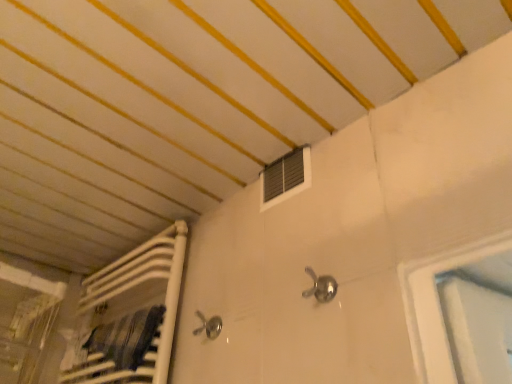
Describe the element at coordinates (321, 287) in the screenshot. This screenshot has width=512, height=384. I see `satin nickel faucet at center` at that location.

In order to face satin nickel faucet at center, should I rotate leftwards or rightwards?

Turn right by 9.237 degrees to look at satin nickel faucet at center.

Image resolution: width=512 pixels, height=384 pixels. Find the location of `satin nickel faucet at center`. satin nickel faucet at center is located at coordinates (321, 287).

Locate an element on the screen. metallic silver air conditioning at upper center is located at coordinates (286, 177).

This screenshot has width=512, height=384. What do you see at coordinates (286, 177) in the screenshot?
I see `metallic silver air conditioning at upper center` at bounding box center [286, 177].

Where is `satin nickel faucet at center`? satin nickel faucet at center is located at coordinates (321, 287).

Is metallic silver air conditioning at upper center at the right side of satin nickel faucet at center?

No.

In the image, is metallic silver air conditioning at upper center positioned in front of or behind satin nickel faucet at center?

Clearly, metallic silver air conditioning at upper center is behind satin nickel faucet at center.

Is point (297, 153) behind point (328, 292)?

Yes, point (297, 153) is behind point (328, 292).

From the image's perspective, is metallic silver air conditioning at upper center located beneath satin nickel faucet at center?

Actually, metallic silver air conditioning at upper center appears above satin nickel faucet at center in the image.

From a real-world perspective, which is physically above, metallic silver air conditioning at upper center or satin nickel faucet at center?

metallic silver air conditioning at upper center, from a real-world perspective.

In terms of width, does metallic silver air conditioning at upper center look wider or thinner when compared to satin nickel faucet at center?

metallic silver air conditioning at upper center is thinner than satin nickel faucet at center.

From their relative heights in the image, would you say metallic silver air conditioning at upper center is taller or shorter than satin nickel faucet at center?

In the image, metallic silver air conditioning at upper center appears to be taller than satin nickel faucet at center.

Does metallic silver air conditioning at upper center have a larger size compared to satin nickel faucet at center?

Yes, metallic silver air conditioning at upper center is bigger than satin nickel faucet at center.

Would you say metallic silver air conditioning at upper center is inside or outside satin nickel faucet at center?

metallic silver air conditioning at upper center is not enclosed by satin nickel faucet at center.

Is metallic silver air conditioning at upper center in contact with satin nickel faucet at center?

No, metallic silver air conditioning at upper center is not in contact with satin nickel faucet at center.

Looking at this image, is satin nickel faucet at center at the back of metallic silver air conditioning at upper center?

No.

Can you tell me how much metallic silver air conditioning at upper center and satin nickel faucet at center differ in facing direction?

There is a 0.0013-degree angle between the facing directions of metallic silver air conditioning at upper center and satin nickel faucet at center.

Locate an element on the screen. The image size is (512, 384). faucet in front of the metallic silver air conditioning at upper center is located at coordinates pos(321,287).

Considering the relative positions of satin nickel faucet at center and metallic silver air conditioning at upper center in the image provided, is satin nickel faucet at center to the left or to the right of metallic silver air conditioning at upper center?

satin nickel faucet at center is positioned on metallic silver air conditioning at upper center's right side.

Who is more distant, satin nickel faucet at center or metallic silver air conditioning at upper center?

metallic silver air conditioning at upper center is behind.

Is point (329, 292) in front of point (278, 174)?

Yes, point (329, 292) is closer to viewer.

From the image's perspective, is satin nickel faucet at center located above metallic silver air conditioning at upper center?

No, from the image's perspective, satin nickel faucet at center is not above metallic silver air conditioning at upper center.

Looking at this image, from a real-world perspective, who is located higher, satin nickel faucet at center or metallic silver air conditioning at upper center?

From a 3D spatial view, metallic silver air conditioning at upper center is above.

In terms of width, does satin nickel faucet at center look wider or thinner when compared to metallic silver air conditioning at upper center?

satin nickel faucet at center is wider than metallic silver air conditioning at upper center.

Considering the relative sizes of satin nickel faucet at center and metallic silver air conditioning at upper center in the image provided, is satin nickel faucet at center shorter than metallic silver air conditioning at upper center?

Yes.

Considering the relative sizes of satin nickel faucet at center and metallic silver air conditioning at upper center in the image provided, is satin nickel faucet at center bigger than metallic silver air conditioning at upper center?

Actually, satin nickel faucet at center might be smaller than metallic silver air conditioning at upper center.

Is satin nickel faucet at center surrounding metallic silver air conditioning at upper center?

No, metallic silver air conditioning at upper center is located outside of satin nickel faucet at center.

Is there a large distance between satin nickel faucet at center and metallic silver air conditioning at upper center?

That's not correct — satin nickel faucet at center is a little close to metallic silver air conditioning at upper center.

Is satin nickel faucet at center facing towards metallic silver air conditioning at upper center?

No, satin nickel faucet at center does not turn towards metallic silver air conditioning at upper center.

How much distance is there between satin nickel faucet at center and metallic silver air conditioning at upper center?

A distance of 10.44 inches exists between satin nickel faucet at center and metallic silver air conditioning at upper center.

Locate an element on the screen. faucet on the right side of metallic silver air conditioning at upper center is located at coordinates (321, 287).

I want to click on air conditioning above the satin nickel faucet at center (from a real-world perspective), so click(x=286, y=177).

In order to click on faucet that is on the right side of metallic silver air conditioning at upper center in this screenshot , I will do `click(321, 287)`.